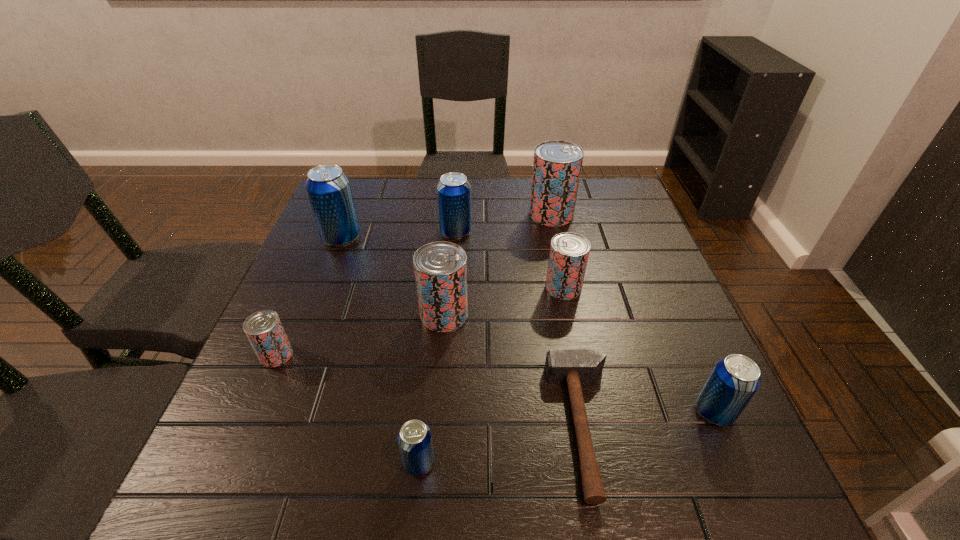
Identify the location of vacant space located on the striking surface of the hammer. The width and height of the screenshot is (960, 540). (429, 426).

Image resolution: width=960 pixels, height=540 pixels. Identify the location of free region located 0.050m on the striking surface of the hammer. (524, 426).

Image resolution: width=960 pixels, height=540 pixels. I want to click on vacant space situated on the striking surface of the hammer, so click(519, 426).

Identify the location of object situated at the far edge. (557, 164).

The width and height of the screenshot is (960, 540). Identify the location of beer can that is positioned at the near edge. (414, 439).

Where is `hammer located at the near edge`? The image size is (960, 540). hammer located at the near edge is located at coordinates (573, 366).

Locate an element on the screen. object located in the right edge section of the desktop is located at coordinates (733, 382).

At what (x,y) coordinates should I click in order to perform the action: click on free spot at the far edge of the desktop. Please return your answer as a coordinate pair (x, y). The width and height of the screenshot is (960, 540). Looking at the image, I should click on (480, 193).

This screenshot has width=960, height=540. What are the coordinates of `vacant space at the near edge` in the screenshot? It's located at (491, 507).

Locate an element on the screen. This screenshot has width=960, height=540. vacant point at the left edge is located at coordinates (319, 249).